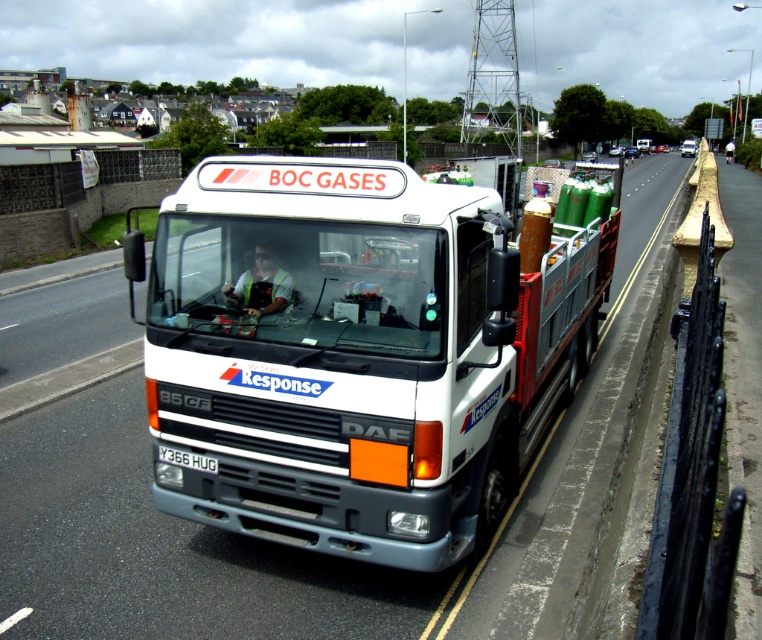
Does white matte truck at center have a smaller size compared to white plastic license plate at center?

No, white matte truck at center is not smaller than white plastic license plate at center.

Is point (418, 568) in front of point (200, 460)?

Yes, it is.

You are a GUI agent. You are given a task and a screenshot of the screen. Output one action in this format:
    pyautogui.click(x=<x>, y=<y>)
    Task: Click on the white matte truck at center
    
    Given the screenshot: What is the action you would take?
    pyautogui.click(x=357, y=353)